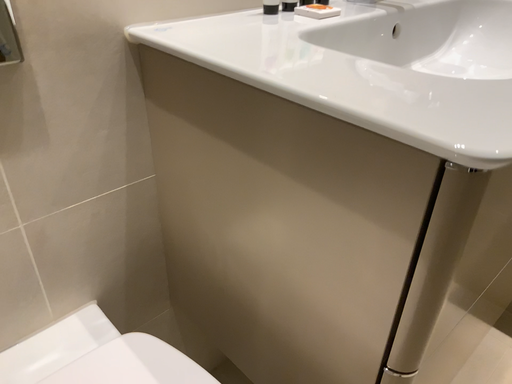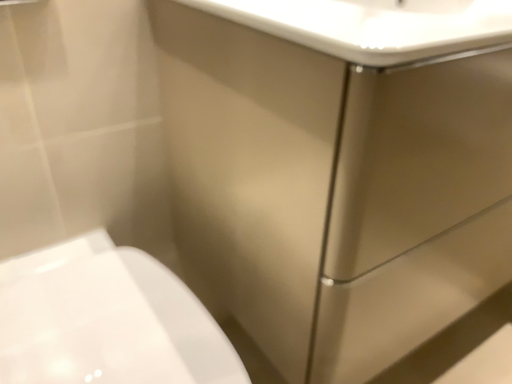
Question: How did the camera likely rotate when shooting the video?

Choices:
 (A) rotated right
 (B) rotated left

Answer: (B)